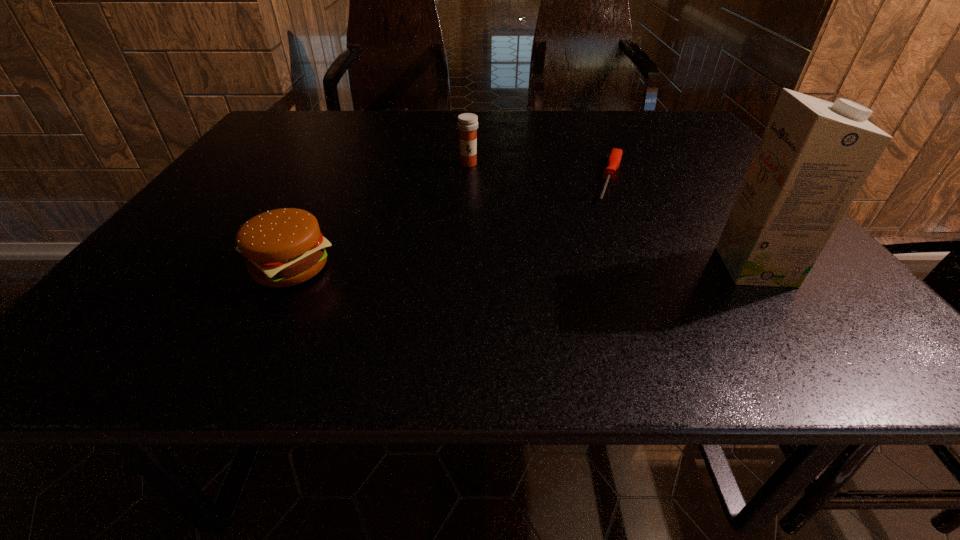
In the image, there is a desktop. What are the coordinates of `free space at the far edge` in the screenshot? It's located at (365, 133).

This screenshot has height=540, width=960. Find the location of `free space at the near edge`. free space at the near edge is located at coordinates (687, 294).

Where is `vacant space at the left edge of the desktop`? vacant space at the left edge of the desktop is located at coordinates (266, 144).

The height and width of the screenshot is (540, 960). What are the coordinates of `vacant area at the right edge of the desktop` in the screenshot? It's located at (670, 168).

At what (x,y) coordinates should I click in order to perform the action: click on free space at the far right corner of the desktop. Please return your answer as a coordinate pair (x, y). The image size is (960, 540). Looking at the image, I should click on (663, 116).

Where is `free space between the shortest object and the rightmost object`? This screenshot has width=960, height=540. free space between the shortest object and the rightmost object is located at coordinates (683, 223).

Locate an element on the screen. Image resolution: width=960 pixels, height=540 pixels. free space between the shortest object and the leftmost object is located at coordinates (450, 223).

Where is `free spot between the screwdriver and the second tallest object`? The image size is (960, 540). free spot between the screwdriver and the second tallest object is located at coordinates (540, 172).

At what (x,y) coordinates should I click in order to perform the action: click on free spot between the carton and the third shortest object. Please return your answer as a coordinate pair (x, y). The image size is (960, 540). Looking at the image, I should click on (612, 215).

The width and height of the screenshot is (960, 540). What are the coordinates of `free area in between the medicine and the leftmost object` in the screenshot? It's located at tap(379, 215).